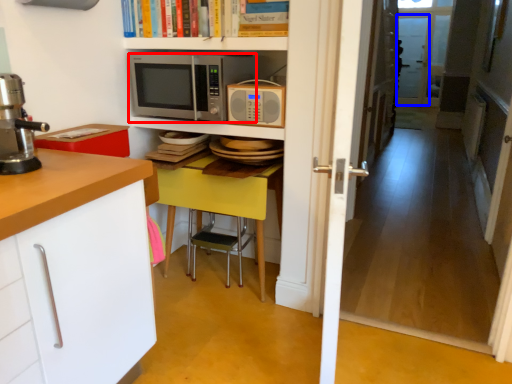
Question: Which object appears farthest to the camera in this image, microwave oven (highlighted by a red box) or screen door (highlighted by a blue box)?

Choices:
 (A) microwave oven
 (B) screen door

Answer: (B)